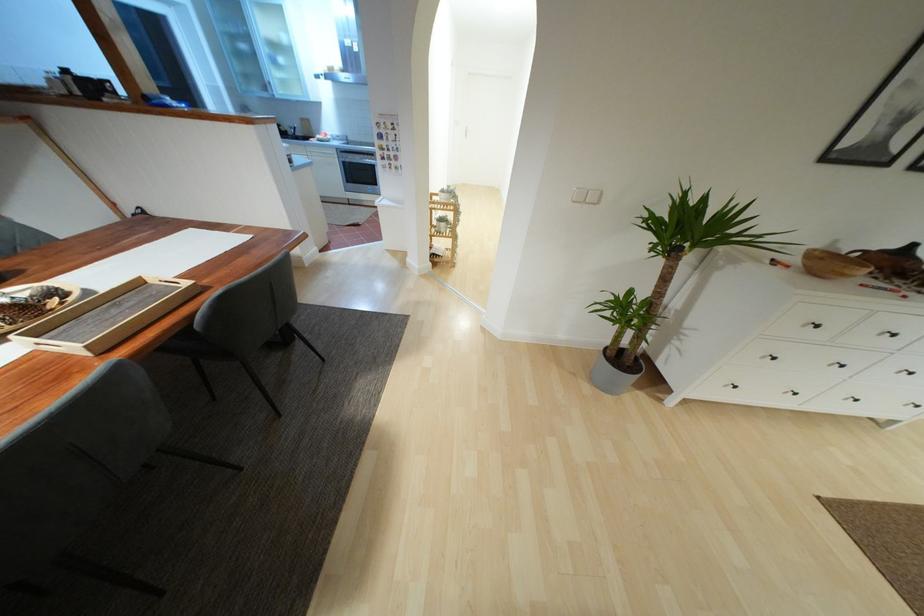
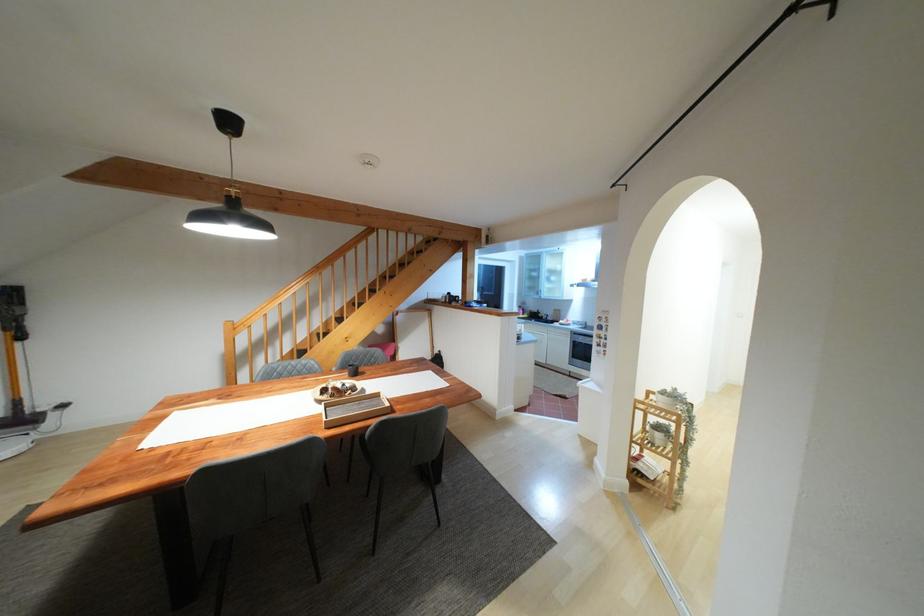
Where in the second image is the point corresponding to [138,283] from the first image?

(377, 395)